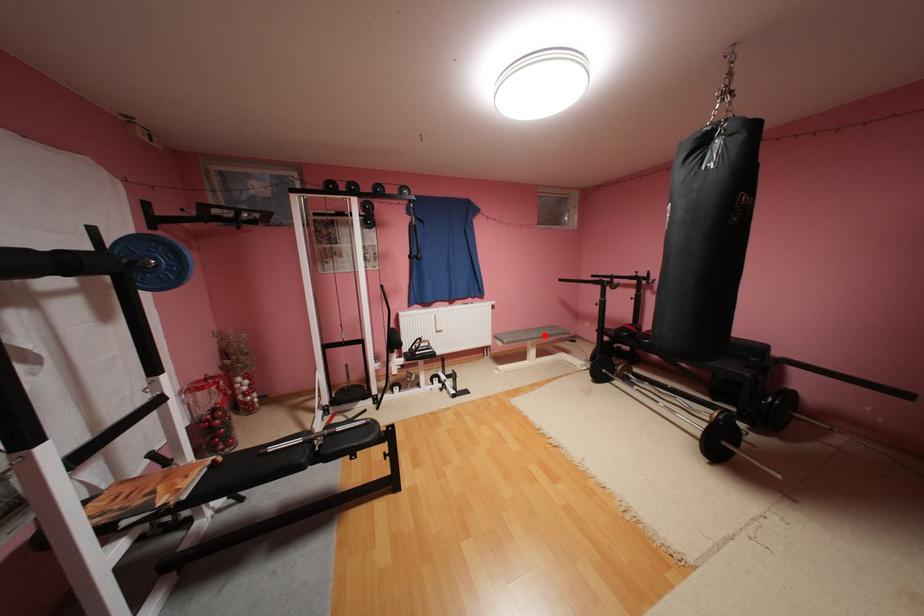
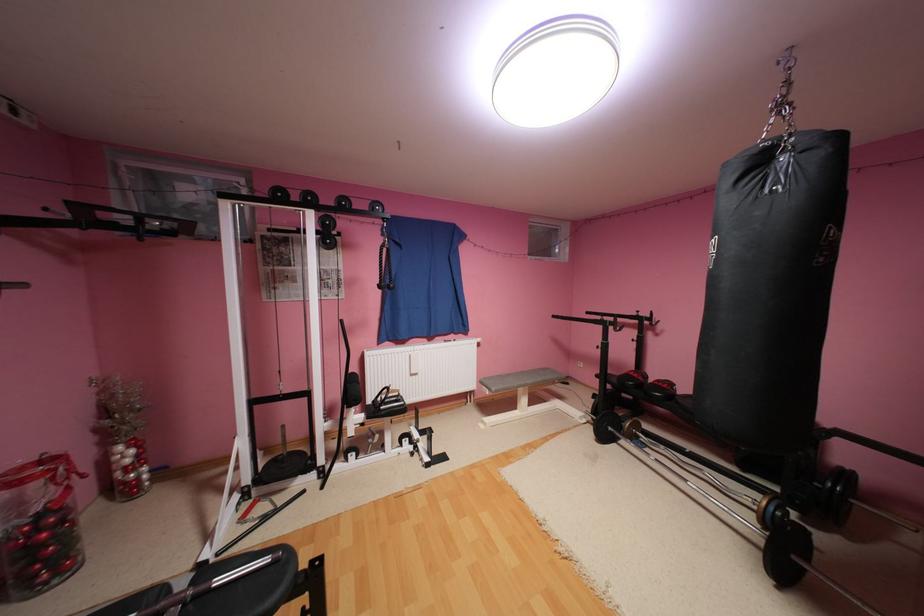
In the second image, find the point that corresponds to the highlighted location in the first image.

(538, 382)